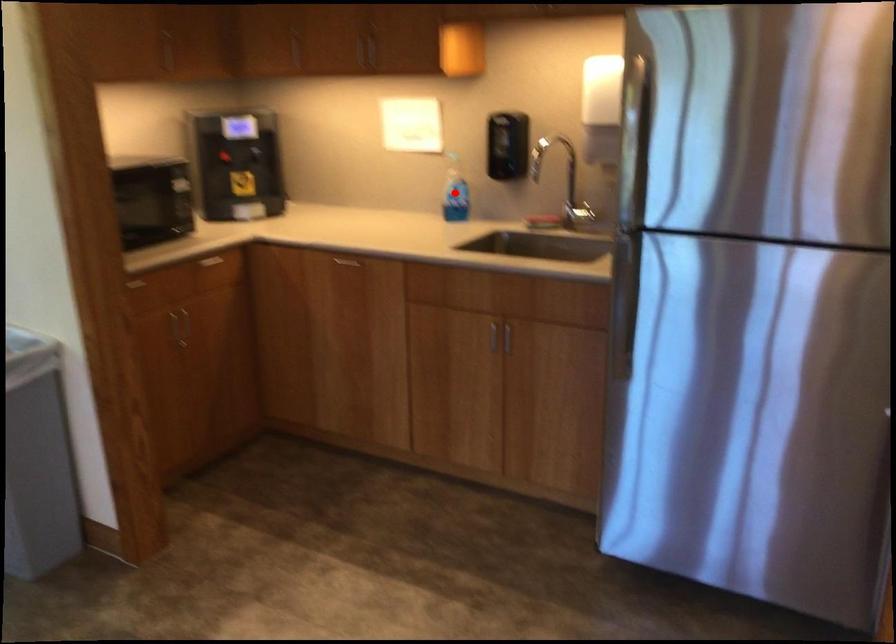
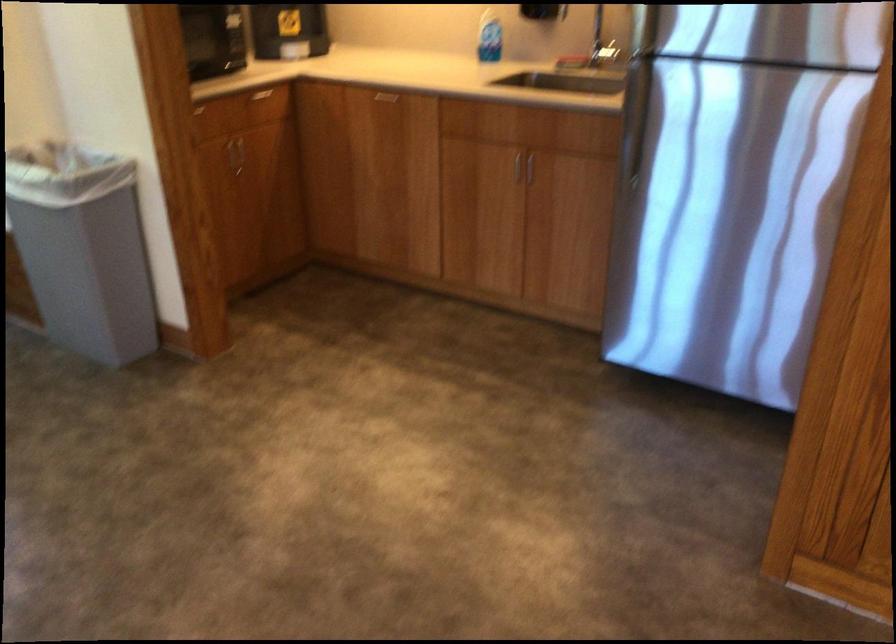
Find the pixel in the second image that matches the highlighted location in the first image.

(488, 37)